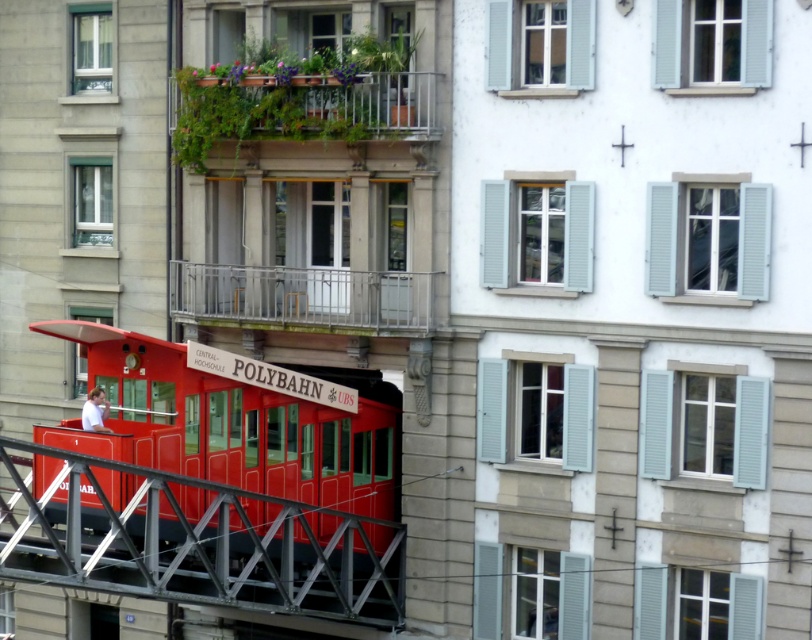
Question: In this image, where is metallic red polybahn car at lower left located relative to silver metallic railing at center?

Choices:
 (A) right
 (B) left

Answer: (B)

Question: Which of the following is the closest to the observer?

Choices:
 (A) metallic red polybahn car at lower left
 (B) silver metallic railing at center

Answer: (A)

Question: Among these points, which one is nearest to the camera?

Choices:
 (A) click(x=182, y=301)
 (B) click(x=136, y=401)

Answer: (B)

Question: Is metallic red polybahn car at lower left closer to the viewer compared to silver metallic railing at center?

Choices:
 (A) yes
 (B) no

Answer: (A)

Question: Where is metallic red polybahn car at lower left located in relation to silver metallic railing at center in the image?

Choices:
 (A) right
 (B) left

Answer: (B)

Question: Which of the following is the closest to the observer?

Choices:
 (A) (318, 404)
 (B) (339, 304)

Answer: (A)